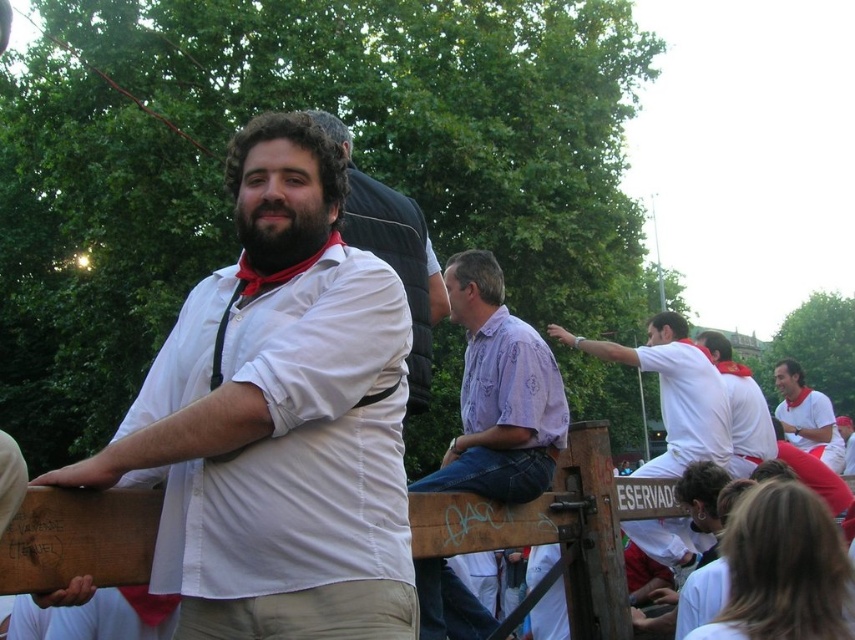
Between white cotton shirt at center and white cotton shirt at upper right, which one is positioned higher?

white cotton shirt at center is higher up.

Does white cotton shirt at center appear over white cotton shirt at upper right?

Yes, white cotton shirt at center is above white cotton shirt at upper right.

Which is in front, point (663, 538) or point (806, 394)?

Positioned in front is point (663, 538).

Where is `white cotton shirt at center`? The height and width of the screenshot is (640, 855). white cotton shirt at center is located at coordinates (671, 392).

Between purple patterned shirt at center and white matte shirt at center, which one is positioned lower?

Positioned lower is purple patterned shirt at center.

Does purple patterned shirt at center have a larger size compared to white matte shirt at center?

Yes.

The image size is (855, 640). I want to click on purple patterned shirt at center, so click(499, 394).

The image size is (855, 640). In order to click on purple patterned shirt at center in this screenshot , I will do `click(499, 394)`.

Does purple patterned shirt at center have a smaller size compared to white cotton shirt at upper right?

Yes.

Can you confirm if purple patterned shirt at center is positioned to the right of white cotton shirt at upper right?

Incorrect, purple patterned shirt at center is not on the right side of white cotton shirt at upper right.

Describe the element at coordinates (499, 394) in the screenshot. I see `purple patterned shirt at center` at that location.

Locate an element on the screen. purple patterned shirt at center is located at coordinates (499, 394).